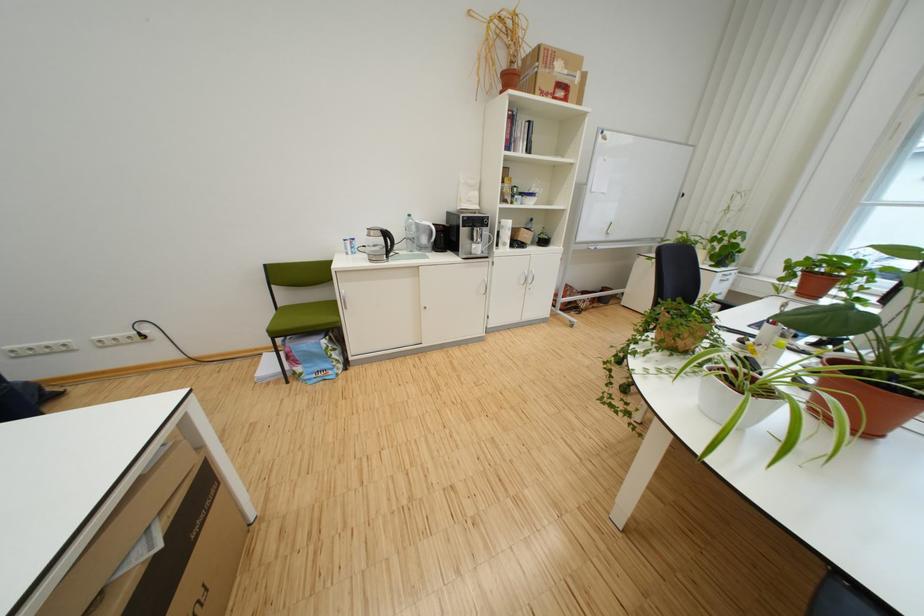
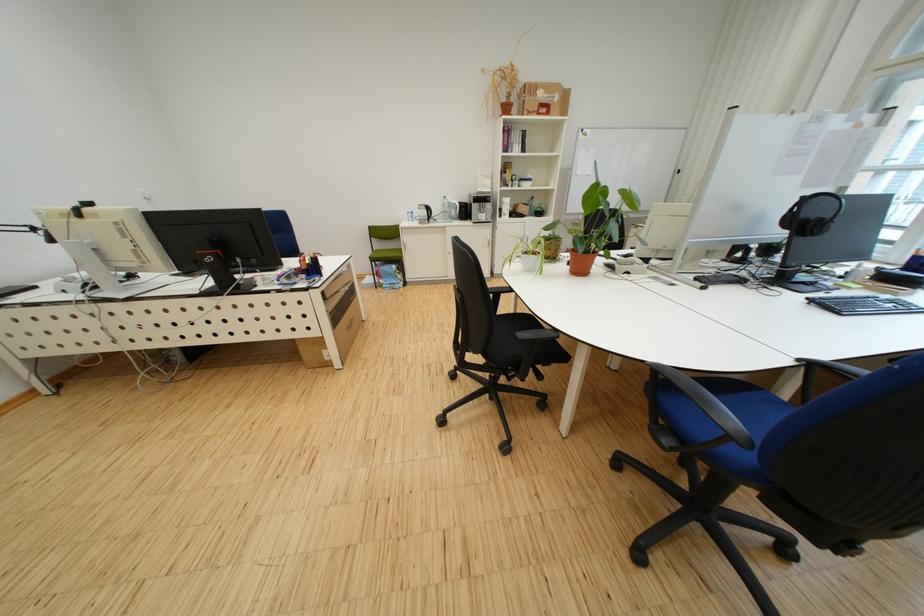
Where in the second image is the point corresponding to pixel 426 229 from the first image?

(458, 207)